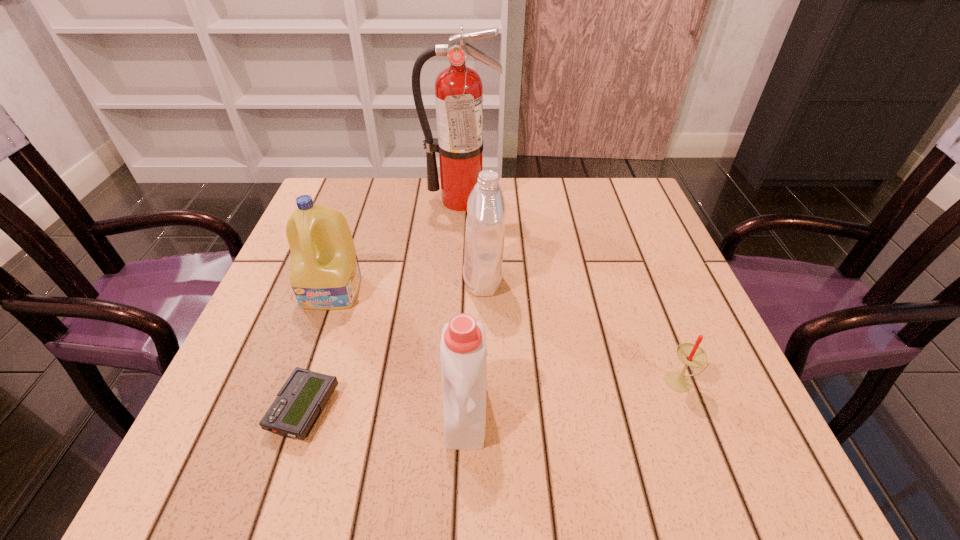
Where is `vacant space at the right edge of the desktop`? The height and width of the screenshot is (540, 960). vacant space at the right edge of the desktop is located at coordinates (639, 366).

The image size is (960, 540). What are the coordinates of `free space at the far left corner of the desktop` in the screenshot? It's located at (356, 196).

This screenshot has width=960, height=540. In the image, there is a desktop. In order to click on vacant area at the far right corner in this screenshot , I will do `click(631, 213)`.

Identify the location of free spot between the nearest detergent and the tallest object. [463, 306].

Where is `vacant area between the leftmost detergent and the rightmost object`? This screenshot has width=960, height=540. vacant area between the leftmost detergent and the rightmost object is located at coordinates (508, 336).

This screenshot has width=960, height=540. I want to click on vacant region between the nearest detergent and the tallest object, so click(463, 306).

You are a GUI agent. You are given a task and a screenshot of the screen. Output one action in this format:
    pyautogui.click(x=<x>, y=<y>)
    Task: Click on the unoccupied area between the tallest object and the nearest detergent
    The height and width of the screenshot is (540, 960).
    Given the screenshot: What is the action you would take?
    pyautogui.click(x=463, y=306)

Image resolution: width=960 pixels, height=540 pixels. What are the coordinates of `unoccupied position between the shortest object and the leftmost detergent` in the screenshot? It's located at (319, 350).

Where is `free space between the leftmost detergent and the beeper`? The image size is (960, 540). free space between the leftmost detergent and the beeper is located at coordinates (319, 350).

Locate which object ranks fifth in proximity to the beeper. Please provide its 2D coordinates. Your answer should be formatted as a tuple, i.e. [(x, y)], where the tuple contains the x and y coordinates of a point satisfying the conditions above.

[(690, 354)]